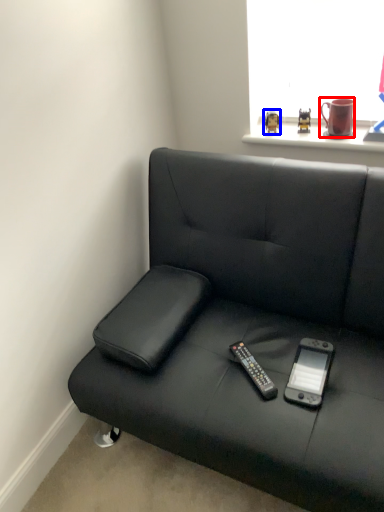
Question: Which of the following is the closest to the observer, mug (highlighted by a red box) or toy (highlighted by a blue box)?

Choices:
 (A) mug
 (B) toy

Answer: (A)